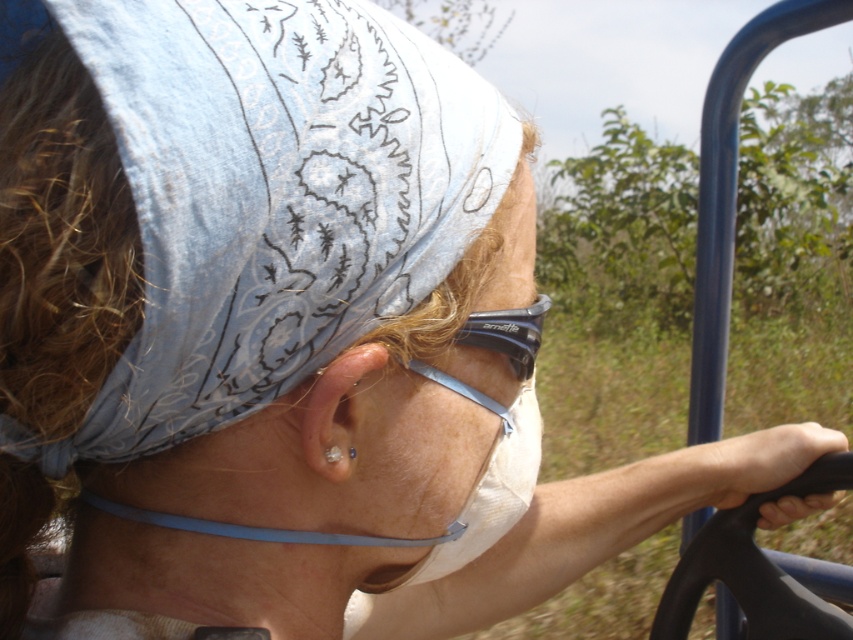
Does white fabric mask at center have a lesser height compared to black rubber goggles at upper center?

Incorrect, white fabric mask at center's height does not fall short of black rubber goggles at upper center's.

This screenshot has width=853, height=640. Find the location of `white fabric mask at center`. white fabric mask at center is located at coordinates pyautogui.click(x=505, y=253).

Which is in front, point (476, 296) or point (538, 340)?

Point (476, 296) is in front.

You are a GUI agent. You are given a task and a screenshot of the screen. Output one action in this format:
    pyautogui.click(x=<x>, y=<y>)
    Task: Click on the white fabric mask at center
    This screenshot has width=853, height=640.
    Given the screenshot: What is the action you would take?
    pyautogui.click(x=505, y=253)

Who is taller, denim bandana at upper left or white fabric mask at center?

white fabric mask at center

Describe the element at coordinates (271, 196) in the screenshot. I see `denim bandana at upper left` at that location.

Where is `denim bandana at upper left`? This screenshot has width=853, height=640. denim bandana at upper left is located at coordinates (271, 196).

Does denim bandana at upper left have a lesser width compared to black rubber goggles at upper center?

Incorrect, denim bandana at upper left's width is not less than black rubber goggles at upper center's.

Is point (463, 216) positioned behind point (503, 333)?

No, it is not.

This screenshot has height=640, width=853. Describe the element at coordinates (271, 196) in the screenshot. I see `denim bandana at upper left` at that location.

This screenshot has height=640, width=853. I want to click on denim bandana at upper left, so click(271, 196).